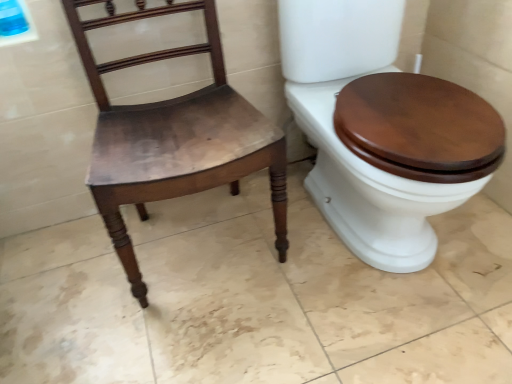
At what (x,y) coordinates should I click in order to perform the action: click on matte wood chair at left. Please return your answer as a coordinate pair (x, y). The image size is (512, 384). Looking at the image, I should click on [174, 136].

What do you see at coordinates (174, 136) in the screenshot? I see `matte wood chair at left` at bounding box center [174, 136].

The width and height of the screenshot is (512, 384). Describe the element at coordinates (370, 190) in the screenshot. I see `wooden toilet seat at right` at that location.

Image resolution: width=512 pixels, height=384 pixels. What are the coordinates of `wooden toilet seat at right` in the screenshot? It's located at (370, 190).

Where is `matte wood chair at left`? This screenshot has width=512, height=384. matte wood chair at left is located at coordinates (174, 136).

Considering the positions of objects matte wood chair at left and wooden toilet seat at right in the image provided, who is more to the right, matte wood chair at left or wooden toilet seat at right?

Positioned to the right is wooden toilet seat at right.

In the scene shown: Considering their positions, is matte wood chair at left located in front of or behind wooden toilet seat at right?

Visually, matte wood chair at left is located behind wooden toilet seat at right.

Does point (84, 41) lie behind point (345, 152)?

Yes, point (84, 41) is farther from viewer.

From the image's perspective, is matte wood chair at left located above or below wooden toilet seat at right?

matte wood chair at left is below wooden toilet seat at right.

From the picture: From a real-world perspective, relative to wooden toilet seat at right, is matte wood chair at left vertically above or below?

matte wood chair at left is situated higher than wooden toilet seat at right in the real world.

Which of these two, matte wood chair at left or wooden toilet seat at right, is thinner?

Thinner between the two is matte wood chair at left.

Considering the sizes of objects matte wood chair at left and wooden toilet seat at right in the image provided, who is shorter, matte wood chair at left or wooden toilet seat at right?

With less height is wooden toilet seat at right.

Considering the sizes of matte wood chair at left and wooden toilet seat at right in the image, is matte wood chair at left bigger or smaller than wooden toilet seat at right?

matte wood chair at left is smaller than wooden toilet seat at right.

Which is correct: matte wood chair at left is inside wooden toilet seat at right, or outside of it?

matte wood chair at left is not inside wooden toilet seat at right, it's outside.

Are matte wood chair at left and wooden toilet seat at right making contact?

matte wood chair at left and wooden toilet seat at right are not in contact.

Is wooden toilet seat at right at the back of matte wood chair at left?

No, matte wood chair at left's orientation is not away from wooden toilet seat at right.

Consider the image. How many degrees apart are the facing directions of matte wood chair at left and wooden toilet seat at right?

The facing directions of matte wood chair at left and wooden toilet seat at right are 0.000208 degrees apart.

Measure the distance from matte wood chair at left to wooden toilet seat at right.

matte wood chair at left and wooden toilet seat at right are 32.42 centimeters apart.

You are a GUI agent. You are given a task and a screenshot of the screen. Output one action in this format:
    pyautogui.click(x=<x>, y=<y>)
    Task: Click on the chair located behind the wooden toilet seat at right
    The width and height of the screenshot is (512, 384).
    Given the screenshot: What is the action you would take?
    pyautogui.click(x=174, y=136)

Considering the relative positions of wooden toilet seat at right and matte wood chair at left in the image provided, is wooden toilet seat at right to the right of matte wood chair at left from the viewer's perspective?

Yes, wooden toilet seat at right is to the right of matte wood chair at left.

Between wooden toilet seat at right and matte wood chair at left, which one is positioned behind?

matte wood chair at left.

Is point (327, 111) farther from camera compared to point (147, 53)?

No, (327, 111) is closer to viewer.

From the image's perspective, is wooden toilet seat at right positioned above or below matte wood chair at left?

Based on their image positions, wooden toilet seat at right is located above matte wood chair at left.

From a real-world perspective, between wooden toilet seat at right and matte wood chair at left, who is vertically higher?

matte wood chair at left.

Which of these two, wooden toilet seat at right or matte wood chair at left, is thinner?

With smaller width is matte wood chair at left.

Is wooden toilet seat at right taller or shorter than matte wood chair at left?

Considering their sizes, wooden toilet seat at right has less height than matte wood chair at left.

Between wooden toilet seat at right and matte wood chair at left, which one has smaller size?

With smaller size is matte wood chair at left.

Is wooden toilet seat at right not within matte wood chair at left?

wooden toilet seat at right is positioned outside matte wood chair at left.

Would you consider wooden toilet seat at right to be distant from matte wood chair at left?

No, there isn't a large distance between wooden toilet seat at right and matte wood chair at left.

Is wooden toilet seat at right aimed at matte wood chair at left?

No.

Can you tell me how much wooden toilet seat at right and matte wood chair at left differ in facing direction?

The facing directions of wooden toilet seat at right and matte wood chair at left are 0.000208 degrees apart.

Locate an element on the screen. toilet in front of the matte wood chair at left is located at coordinates (370, 190).

Locate an element on the screen. The width and height of the screenshot is (512, 384). chair on the left of the wooden toilet seat at right is located at coordinates (174, 136).

Image resolution: width=512 pixels, height=384 pixels. Find the location of `chair behind the wooden toilet seat at right`. chair behind the wooden toilet seat at right is located at coordinates (174, 136).